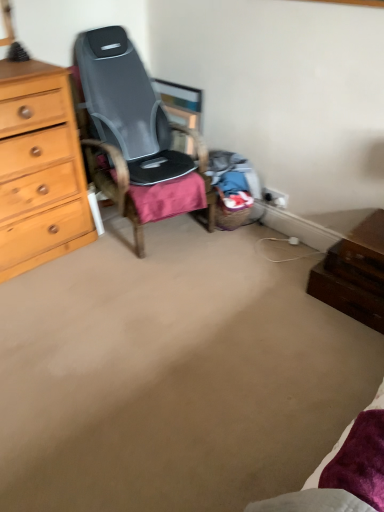
The image size is (384, 512). What do you see at coordinates (354, 274) in the screenshot? I see `dark wood nightstand at lower right` at bounding box center [354, 274].

I want to click on dark wood nightstand at lower right, so click(x=354, y=274).

In order to face dark wood nightstand at lower right, should I rotate leftwards or rightwards?

Turn right approximately 21.441 degrees to face it.

Where is `dark wood nightstand at lower right`? dark wood nightstand at lower right is located at coordinates pyautogui.click(x=354, y=274).